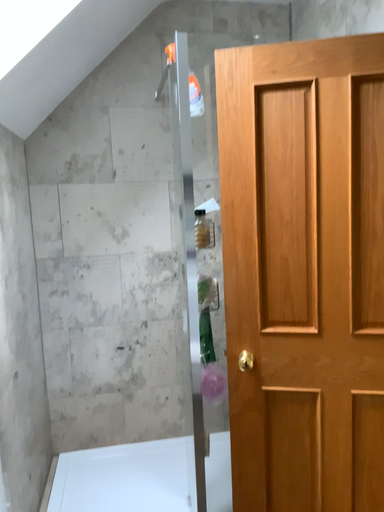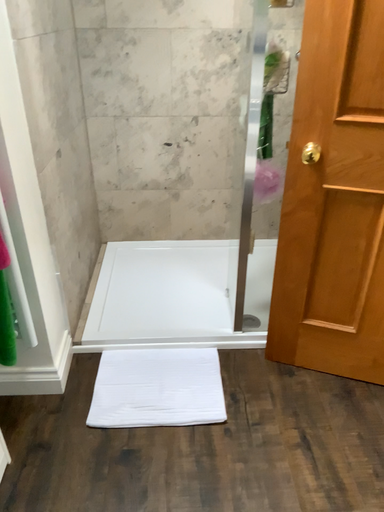
Question: How did the camera likely rotate when shooting the video?

Choices:
 (A) rotated upward
 (B) rotated downward

Answer: (B)